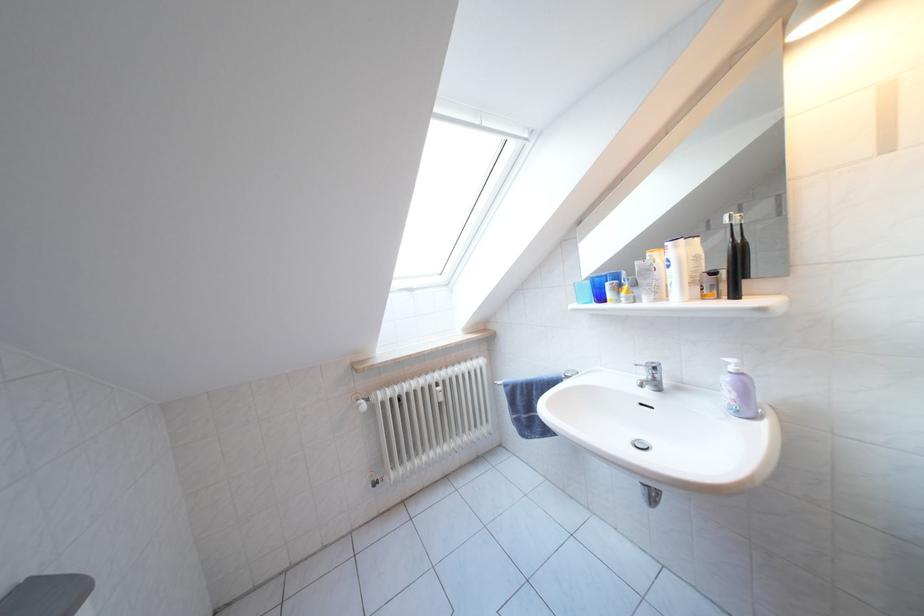
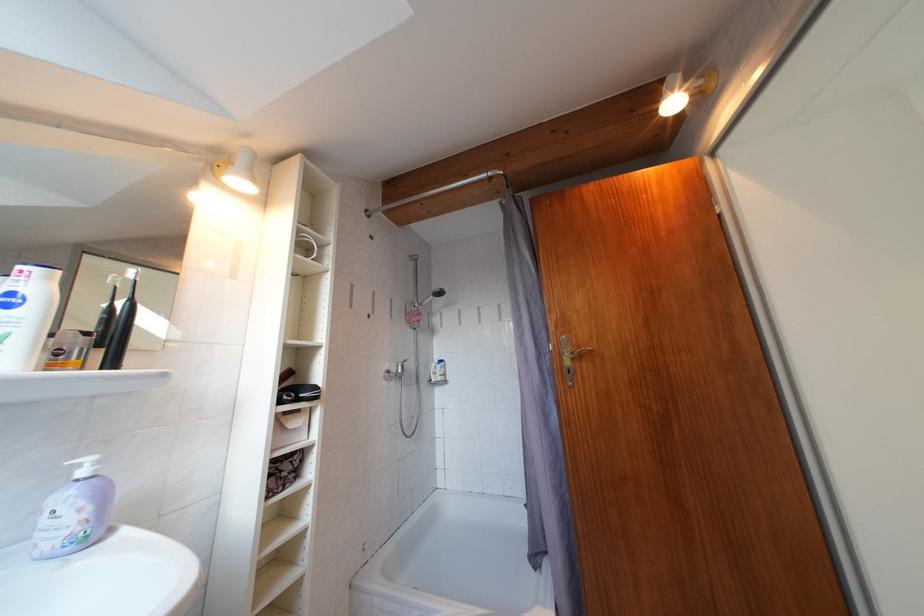
The point at (685, 252) is marked in the first image. Where is the corresponding point in the second image?

(56, 283)